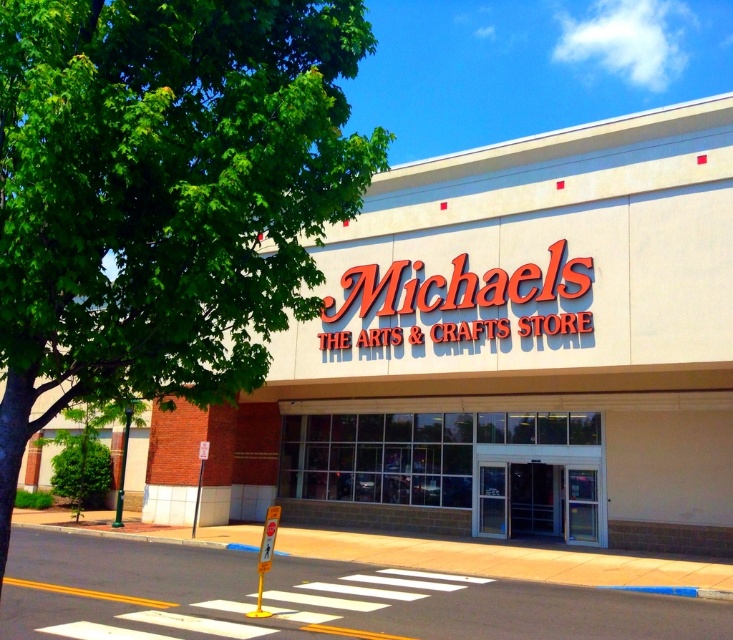
Can you confirm if white smooth building at center is positioned above green leafy tree at upper left?

No, white smooth building at center is not above green leafy tree at upper left.

Is white smooth building at center thinner than green leafy tree at upper left?

No, white smooth building at center is not thinner than green leafy tree at upper left.

The height and width of the screenshot is (640, 733). Find the location of `white smooth building at center`. white smooth building at center is located at coordinates (501, 353).

Is white smooth building at center to the left of clear glass doors at center from the viewer's perspective?

Indeed, white smooth building at center is positioned on the left side of clear glass doors at center.

Between white smooth building at center and clear glass doors at center, which one appears on the right side from the viewer's perspective?

Positioned to the right is clear glass doors at center.

Measure the distance between point (290,337) and camera.

Point (290,337) is 18.77 meters away from camera.

At what (x,y) coordinates should I click in order to perform the action: click on white smooth building at center. Please return your answer as a coordinate pair (x, y). Looking at the image, I should click on point(501,353).

Who is more distant from viewer, (163, 324) or (386, 458)?

Positioned behind is point (386, 458).

Locate an element on the screen. This screenshot has height=640, width=733. green leafy tree at upper left is located at coordinates (163, 195).